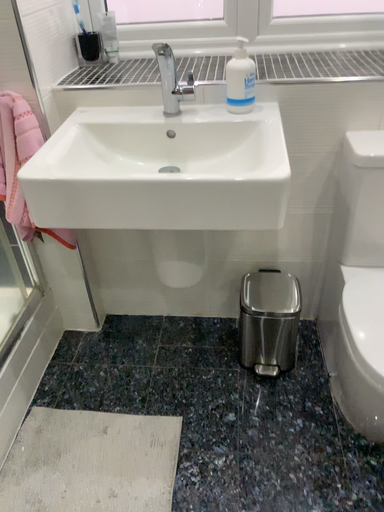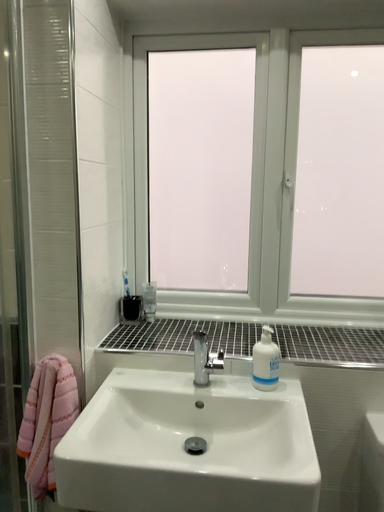
Question: Which way did the camera rotate in the video?

Choices:
 (A) rotated downward
 (B) rotated upward

Answer: (B)